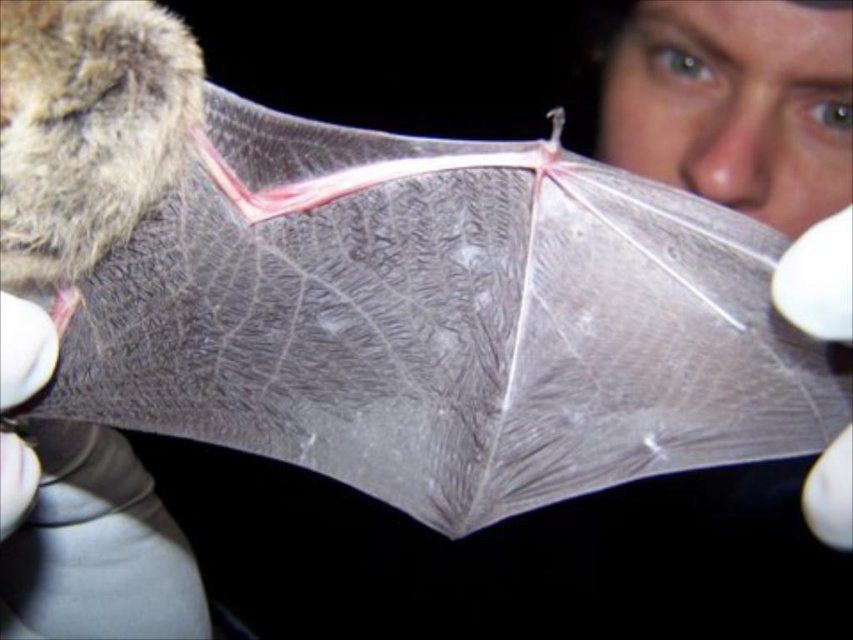
Question: Which object appears farthest from the camera in this image?

Choices:
 (A) white matte glove at right
 (B) white matte glove at lower left

Answer: (B)

Question: Does white matte glove at right appear on the right side of white matte glove at lower left?

Choices:
 (A) yes
 (B) no

Answer: (A)

Question: Does smooth skin nose at center appear under white matte glove at lower left?

Choices:
 (A) no
 (B) yes

Answer: (A)

Question: In this image, where is smooth skin nose at center located relative to white matte glove at lower left?

Choices:
 (A) right
 (B) left

Answer: (A)

Question: Based on their relative distances, which object is nearer to the smooth skin nose at center?

Choices:
 (A) white matte glove at lower left
 (B) white matte glove at right

Answer: (B)

Question: Among these points, which one is nearest to the camera?

Choices:
 (A) (19, 307)
 (B) (769, 186)

Answer: (A)